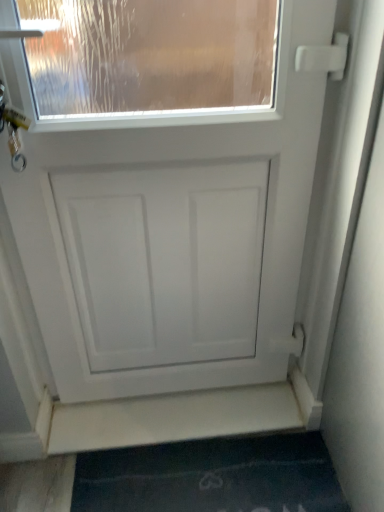
Question: From a real-world perspective, is white matte stairwell at lower center located beneath dark blue carpet at lower center?

Choices:
 (A) yes
 (B) no

Answer: (B)

Question: Considering the relative sizes of white matte stairwell at lower center and dark blue carpet at lower center in the image provided, is white matte stairwell at lower center wider than dark blue carpet at lower center?

Choices:
 (A) yes
 (B) no

Answer: (B)

Question: Is dark blue carpet at lower center located within white matte stairwell at lower center?

Choices:
 (A) no
 (B) yes

Answer: (A)

Question: Considering the relative sizes of white matte stairwell at lower center and dark blue carpet at lower center in the image provided, is white matte stairwell at lower center smaller than dark blue carpet at lower center?

Choices:
 (A) no
 (B) yes

Answer: (B)

Question: Is white matte stairwell at lower center further to the viewer compared to dark blue carpet at lower center?

Choices:
 (A) no
 (B) yes

Answer: (B)

Question: Is the depth of white matte stairwell at lower center less than that of dark blue carpet at lower center?

Choices:
 (A) yes
 (B) no

Answer: (B)

Question: Does dark blue carpet at lower center appear on the right side of white matte door at center?

Choices:
 (A) yes
 (B) no

Answer: (A)

Question: Is dark blue carpet at lower center thinner than white matte door at center?

Choices:
 (A) no
 (B) yes

Answer: (A)

Question: Is white matte door at center surrounded by dark blue carpet at lower center?

Choices:
 (A) yes
 (B) no

Answer: (B)

Question: Does dark blue carpet at lower center turn towards white matte door at center?

Choices:
 (A) yes
 (B) no

Answer: (B)

Question: From the image's perspective, is dark blue carpet at lower center over white matte door at center?

Choices:
 (A) yes
 (B) no

Answer: (B)

Question: Is there a large distance between dark blue carpet at lower center and white matte door at center?

Choices:
 (A) yes
 (B) no

Answer: (B)

Question: From the image's perspective, is dark blue carpet at lower center beneath white matte stairwell at lower center?

Choices:
 (A) yes
 (B) no

Answer: (A)